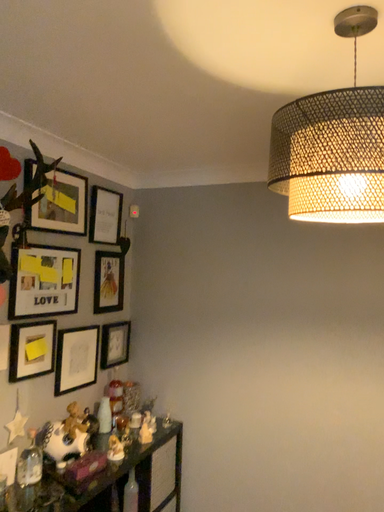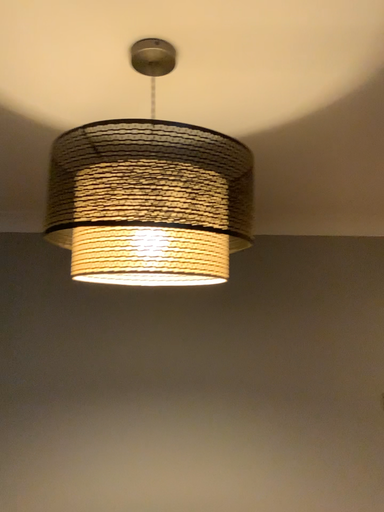
Question: Which way did the camera rotate in the video?

Choices:
 (A) rotated downward
 (B) rotated upward

Answer: (B)